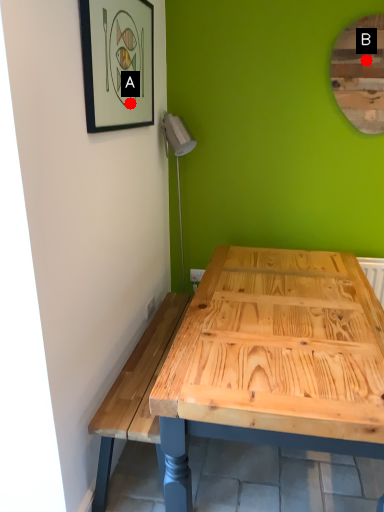
Question: Two points are circled on the image, labeled by A and B beside each circle. Which point is farther to the camera?

Choices:
 (A) A is further
 (B) B is further

Answer: (B)